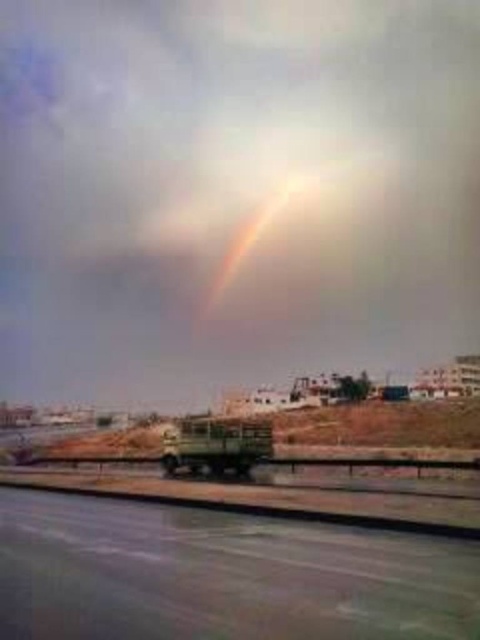
Question: Which point appears closest to the camera in this image?

Choices:
 (A) (21, 544)
 (B) (268, 429)
 (C) (204, 312)
 (D) (86, 97)

Answer: (A)

Question: Does rainbow translucent cloud at upper center have a larger size compared to green matte trailer truck at center?

Choices:
 (A) yes
 (B) no

Answer: (A)

Question: Based on their relative distances, which object is farther from the rainbow at center?

Choices:
 (A) smooth asphalt highway at lower center
 (B) rainbow translucent cloud at upper center
 (C) green matte trailer truck at center

Answer: (A)

Question: Does green matte trailer truck at center appear on the left side of rainbow at center?

Choices:
 (A) yes
 (B) no

Answer: (B)

Question: Which is farther from the rainbow at center?

Choices:
 (A) green matte trailer truck at center
 (B) rainbow translucent cloud at upper center

Answer: (A)

Question: Can you confirm if rainbow translucent cloud at upper center is smaller than smooth asphalt highway at lower center?

Choices:
 (A) no
 (B) yes

Answer: (A)